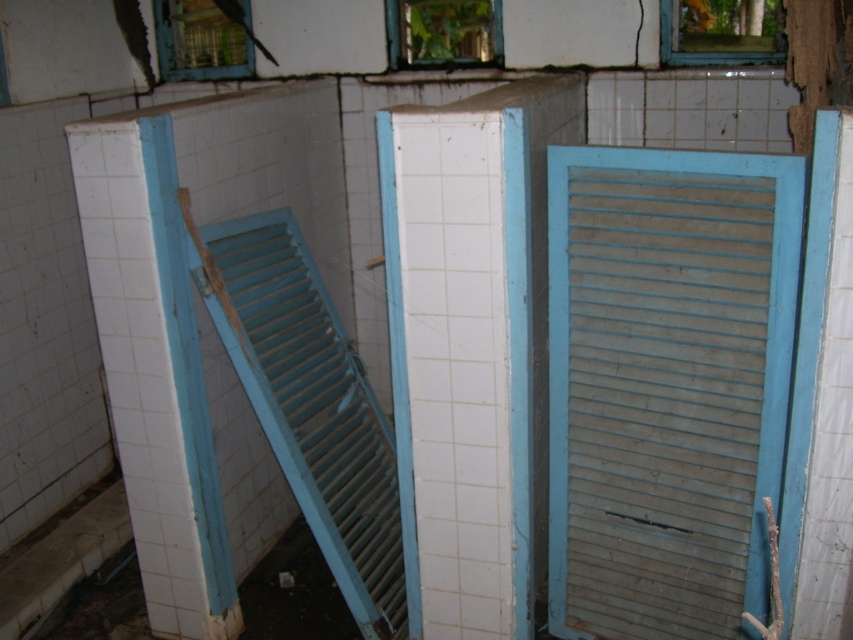
Question: Based on their relative distances, which object is nearer to the blue painted wood shutter at left?

Choices:
 (A) clear glass window at upper center
 (B) transparent glass window at upper center
 (C) wooden lattice window at upper center
 (D) wooden slats at center

Answer: (D)

Question: Does transparent glass window at upper center have a lesser width compared to wooden lattice window at upper center?

Choices:
 (A) yes
 (B) no

Answer: (B)

Question: Which point is farther to the camera?

Choices:
 (A) (717, 490)
 (B) (286, 248)
 (C) (689, 61)
 (D) (439, 45)

Answer: (D)

Question: Which point appears farthest from the camera in this image?

Choices:
 (A) (733, 253)
 (B) (201, 61)
 (C) (392, 44)
 (D) (717, 60)

Answer: (B)

Question: Is clear glass window at upper center smaller than transparent glass window at upper center?

Choices:
 (A) no
 (B) yes

Answer: (B)

Question: Is transparent glass window at upper center positioned at the back of wooden lattice window at upper center?

Choices:
 (A) no
 (B) yes

Answer: (A)